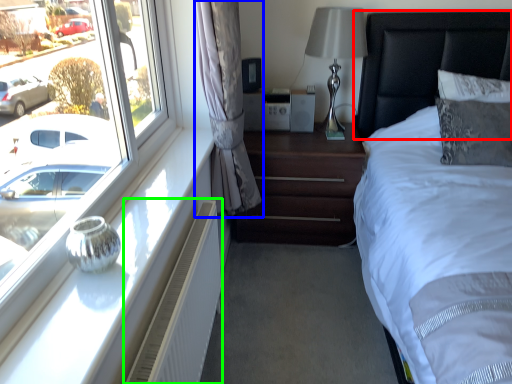
Question: Which is nearer to the headboard (highlighted by a red box)? curtain (highlighted by a blue box) or air conditioner (highlighted by a green box).

Choices:
 (A) curtain
 (B) air conditioner

Answer: (A)